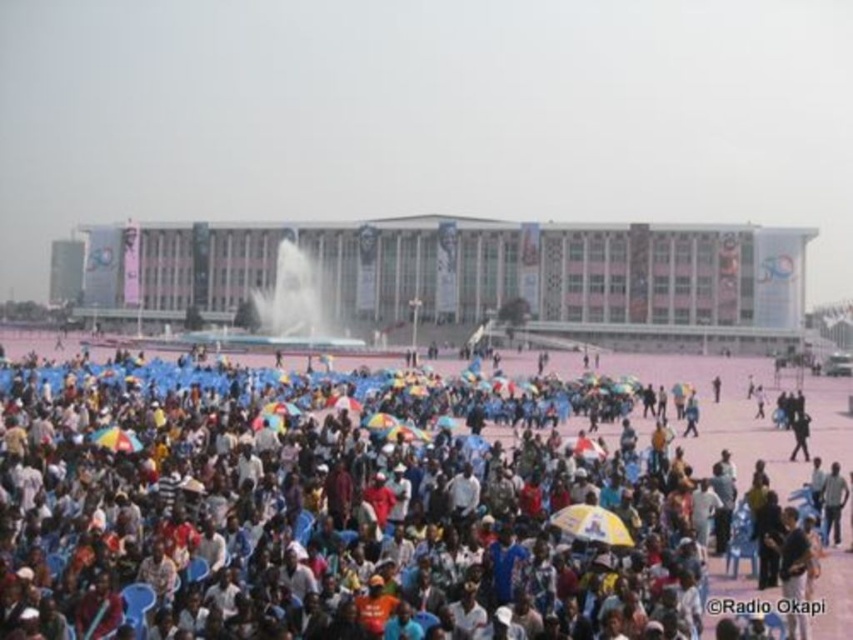
Question: Which of the following is the closest to the observer?

Choices:
 (A) (585, 300)
 (B) (332, 342)

Answer: (B)

Question: Among these objects, which one is nearest to the camera?

Choices:
 (A) yellowmaterial/textureumbrella at center
 (B) pink concrete plaza at center
 (C) blue fabric umbrellas at lower center
 (D) white frothy water at center

Answer: (C)

Question: Is blue fabric umbrellas at lower center to the left of pink concrete plaza at center from the viewer's perspective?

Choices:
 (A) yes
 (B) no

Answer: (B)

Question: Which is farther from the pink concrete plaza at center?

Choices:
 (A) blue fabric umbrellas at lower center
 (B) white frothy water at center
 (C) yellowmaterial/textureumbrella at center

Answer: (C)

Question: Is pink concrete plaza at center smaller than yellowmaterial/textureumbrella at center?

Choices:
 (A) yes
 (B) no

Answer: (B)

Question: Is blue fabric umbrellas at lower center below yellowmaterial/textureumbrella at center?

Choices:
 (A) no
 (B) yes

Answer: (A)